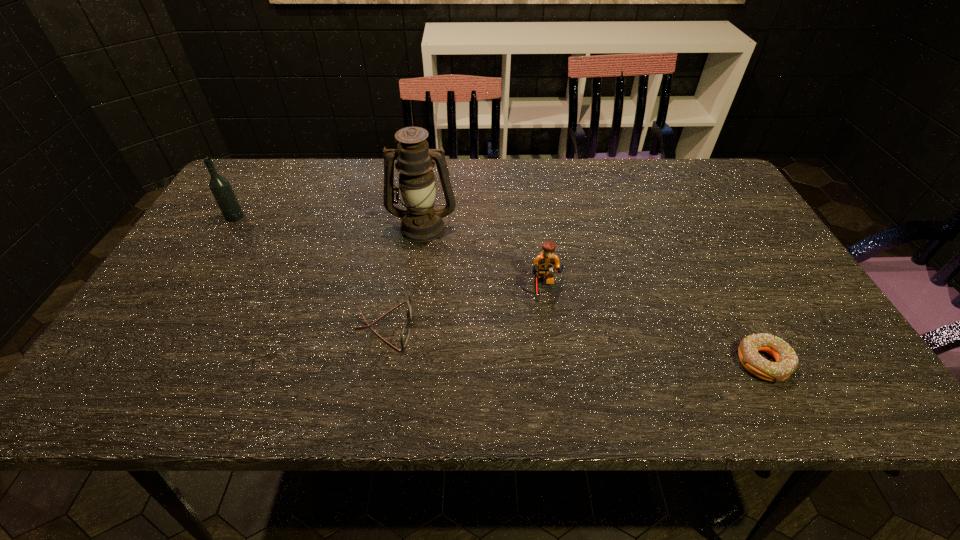
Find the location of a particular element. The height and width of the screenshot is (540, 960). free spot at the far left corner of the desktop is located at coordinates (254, 166).

The image size is (960, 540). I want to click on vacant point located between the oil lamp and the rightmost object, so click(x=593, y=294).

Locate an element on the screen. This screenshot has height=540, width=960. unoccupied area between the doughnut and the spectacles is located at coordinates (574, 345).

Locate an element on the screen. The width and height of the screenshot is (960, 540). unoccupied position between the rightmost object and the spectacles is located at coordinates (574, 345).

I want to click on empty space between the spectacles and the leftmost object, so click(310, 272).

This screenshot has height=540, width=960. I want to click on free area in between the doughnut and the Lego, so click(652, 325).

The width and height of the screenshot is (960, 540). I want to click on empty location between the rightmost object and the second object from right to left, so click(x=652, y=325).

This screenshot has width=960, height=540. In order to click on vacant space that's between the fourth shortest object and the oil lamp in this screenshot , I will do `click(328, 221)`.

Locate an element on the screen. The height and width of the screenshot is (540, 960). free space between the oil lamp and the spectacles is located at coordinates (404, 276).

You are a GUI agent. You are given a task and a screenshot of the screen. Output one action in this format:
    pyautogui.click(x=<x>, y=<y>)
    Task: Click on the vacant space in between the fourth object from left to right and the spectacles
    The height and width of the screenshot is (540, 960).
    Given the screenshot: What is the action you would take?
    pyautogui.click(x=463, y=307)